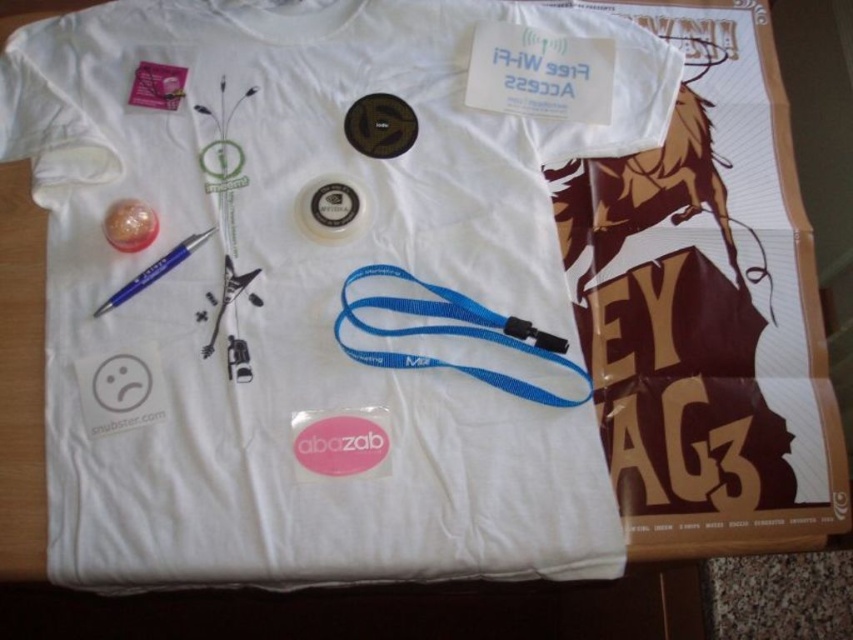
You are standing in front of the wooden surface with the white T shirt. The point at (238, 324) is the center of the T shirt. If you want to place a sticker exactly 76.97 centimeters away from the center, where should you place it?

You should place the sticker 76.97 centimeters away from the point at (238, 324), which is the center of the T shirt.

You are holding a blue plastic pen at upper left and want to draw on the white matte sad face at lower left. Can you reach it without moving the pen?

The white matte sad face at lower left is closer to the viewer than the blue plastic pen at upper left, so you can reach it by moving the pen downward towards the face.

You are a customer looking at this T shirt and want to know where the white matte sad face at lower left is in relation to the metallic silver guitar at center. Can you tell me?

The white matte sad face at lower left is positioned under the metallic silver guitar at center.